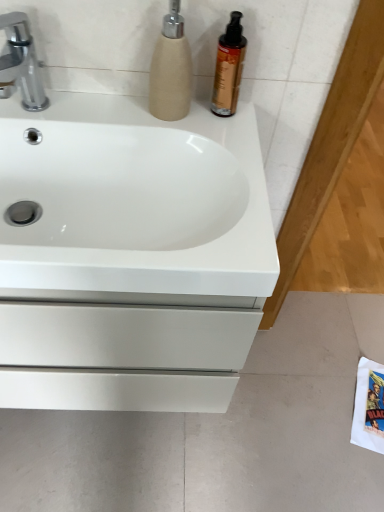
Find the location of a particular element. free space in front of shiny amber bottle at upper right is located at coordinates (226, 144).